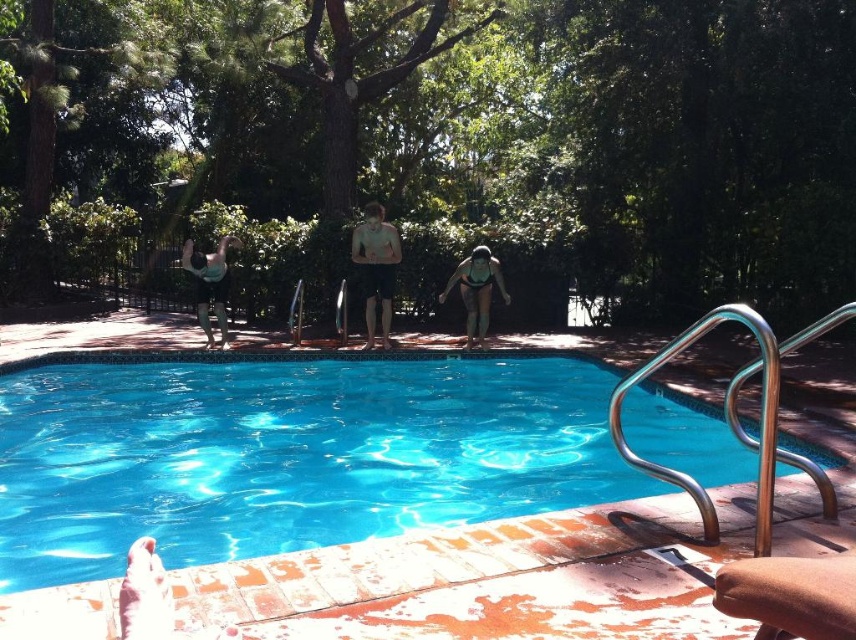
You are a photographer planning to capture a closeup shot of the matte black bikini at center and the matte black swimsuit at upper left. Given that your camera can focus on objects within a 3 meter range, will both items be in focus at the same time?

The matte black bikini at center and the matte black swimsuit at upper left are 3.34 meters apart, so they are slightly beyond the camera focus range of 3 meters. Therefore, both items cannot be in focus simultaneously.

You are standing at the edge of the pool and want to reach a floating ring located at point (370,282). If your maximum reach is 25 feet, will you be able to grab it without moving?

The distance of point (370,282) from camera is 30.20 feet, so you cannot reach the floating ring as it is 5.2 feet beyond your maximum reach of 25 feet.

You are a photographer trying to capture a closeup shot of the smooth skin man at center and the matte black bikini at center. Your camera has a minimum focus distance of 1 meter. Can you take the photo without moving either subject?

The smooth skin man at center and the matte black bikini at center are 1.14 meters apart from each other, so yes, the camera can focus as the distance between them is greater than the minimum focus distance of 1 meter.